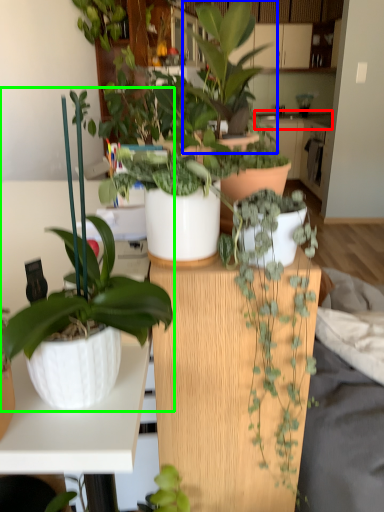
Question: Estimate the real-world distances between objects in this image. Which object is closer to counter top (highlighted by a red box), houseplant (highlighted by a blue box) or houseplant (highlighted by a green box)?

Choices:
 (A) houseplant
 (B) houseplant

Answer: (A)